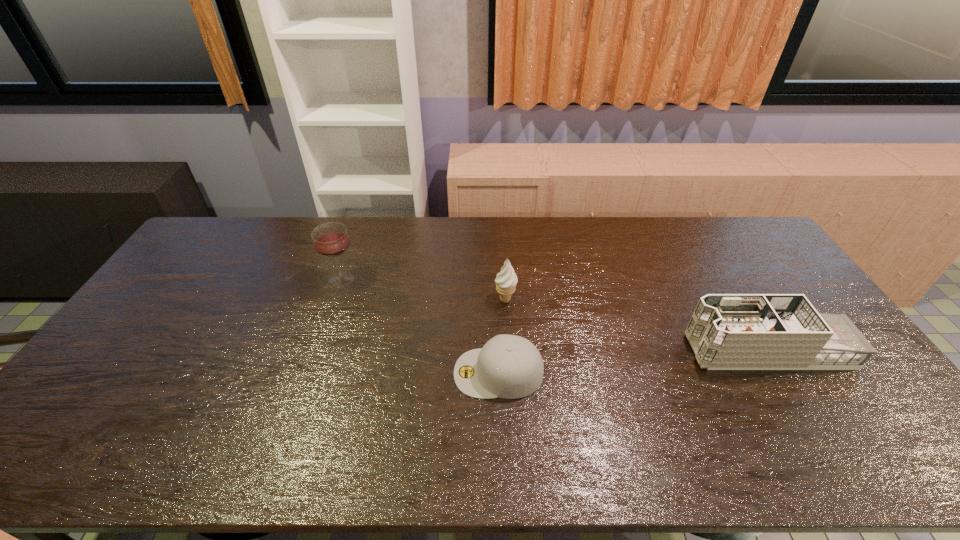
You are a GUI agent. You are given a task and a screenshot of the screen. Output one action in this format:
    pyautogui.click(x=<x>, y=<y>)
    Task: Click on the leftmost object
    Image resolution: width=960 pixels, height=540 pixels.
    Given the screenshot: What is the action you would take?
    pyautogui.click(x=331, y=239)

The width and height of the screenshot is (960, 540). Identify the location of wineglass. (331, 239).

Identify the location of icecream. (506, 280).

Locate an element on the screen. the rightmost object is located at coordinates (727, 331).

What are the coordinates of `cap` in the screenshot? It's located at (508, 366).

In order to click on vacant space located 0.280m on the left of the leftmost object in this screenshot , I will do `click(241, 280)`.

Locate an element on the screen. This screenshot has height=540, width=960. free space located 0.340m on the front-facing side of the third nearest object is located at coordinates (386, 300).

Where is `free space located on the front-facing side of the third nearest object`? The height and width of the screenshot is (540, 960). free space located on the front-facing side of the third nearest object is located at coordinates (402, 300).

I want to click on vacant position located 0.320m on the front-facing side of the third nearest object, so click(393, 300).

Locate an element on the screen. This screenshot has height=540, width=960. free space located at the entrance of the rightmost object is located at coordinates (576, 350).